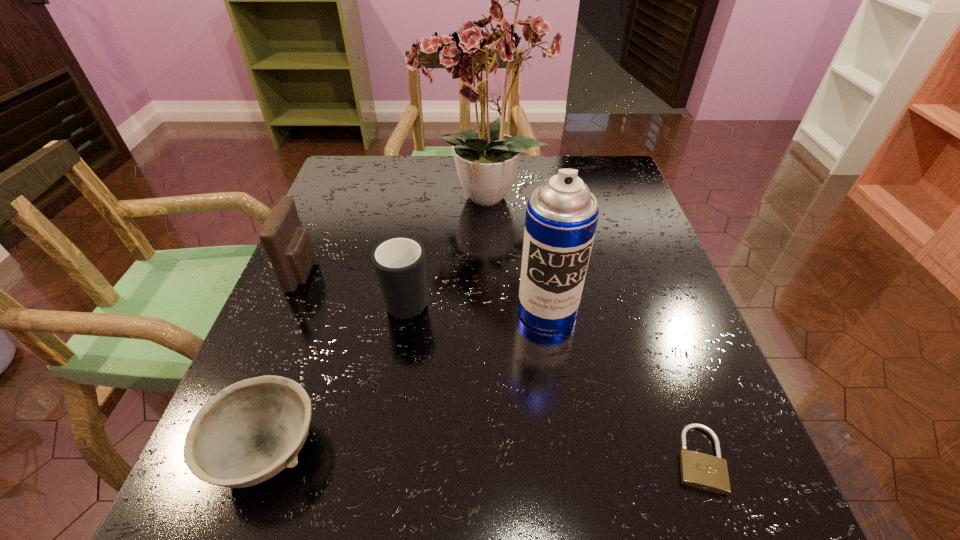
I want to click on vacant space positioned on the label side of the fifth shortest object, so click(572, 483).

At what (x,y) coordinates should I click in order to perform the action: click on free space located with an open flap on the pouch. Please return your answer as a coordinate pair (x, y). Looking at the image, I should click on (499, 273).

The height and width of the screenshot is (540, 960). Find the location of `vacant space situated 0.370m on the side of the mug with the handle`. vacant space situated 0.370m on the side of the mug with the handle is located at coordinates (x=427, y=180).

Identify the location of free space located 0.330m on the side of the mug with the handle. (425, 188).

Locate an element on the screen. vacant space located on the side of the mug with the handle is located at coordinates (424, 199).

This screenshot has width=960, height=540. In order to click on vacant space situated on the right of the bowl in this screenshot , I will do `click(563, 451)`.

At what (x,y) coordinates should I click in order to perform the action: click on vacant area situated 0.240m on the left of the padlock. Please return your answer as a coordinate pair (x, y). Looking at the image, I should click on (510, 458).

Find the location of a particular element. The image size is (960, 540). object located in the far edge section of the desktop is located at coordinates pyautogui.click(x=489, y=44).

Identify the location of bowl that is at the near edge. This screenshot has width=960, height=540. [250, 431].

This screenshot has height=540, width=960. Find the location of `padlock located at the near edge`. padlock located at the near edge is located at coordinates (698, 470).